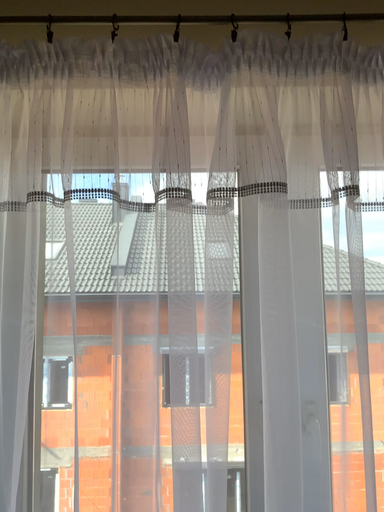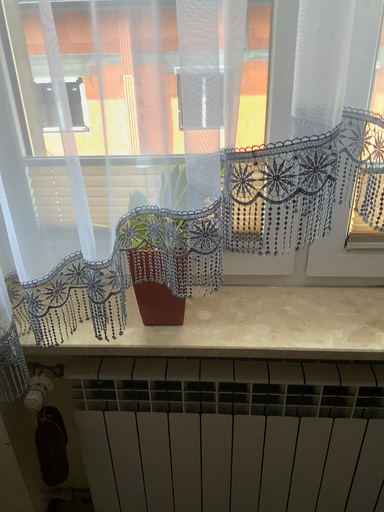
Question: How did the camera likely rotate when shooting the video?

Choices:
 (A) rotated upward
 (B) rotated downward

Answer: (B)